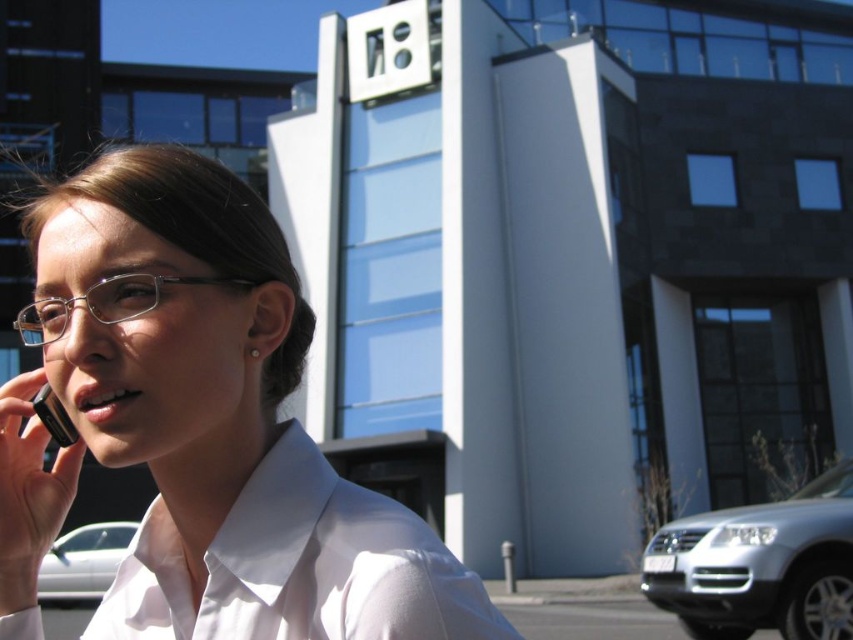
Between white smooth shirt at center and white glossy car at lower left, which one is positioned higher?

white smooth shirt at center is higher up.

Measure the distance between white smooth shirt at center and white glossy car at lower left.

The distance of white smooth shirt at center from white glossy car at lower left is 18.20 meters.

Does point (305, 576) come behind point (109, 557)?

That is False.

I want to click on white smooth shirt at center, so click(x=299, y=566).

Is white glossy shirt at center positioned behind white smooth shirt at center?

Yes, white glossy shirt at center is behind white smooth shirt at center.

Who is positioned more to the left, white glossy shirt at center or white smooth shirt at center?

white glossy shirt at center

The image size is (853, 640). I want to click on white glossy shirt at center, so click(x=202, y=428).

Does white glossy shirt at center have a larger size compared to black glossy smartphone at left?

Indeed, white glossy shirt at center has a larger size compared to black glossy smartphone at left.

Is point (271, 380) positioned before point (68, 444)?

That is False.

You are a GUI agent. You are given a task and a screenshot of the screen. Output one action in this format:
    pyautogui.click(x=<x>, y=<y>)
    Task: Click on the white glossy shirt at center
    
    Given the screenshot: What is the action you would take?
    pyautogui.click(x=202, y=428)